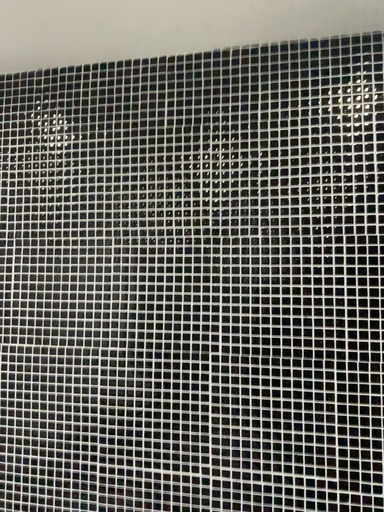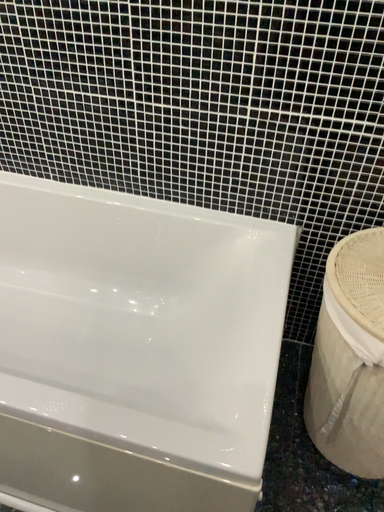
Question: How did the camera likely rotate when shooting the video?

Choices:
 (A) rotated downward
 (B) rotated upward

Answer: (A)